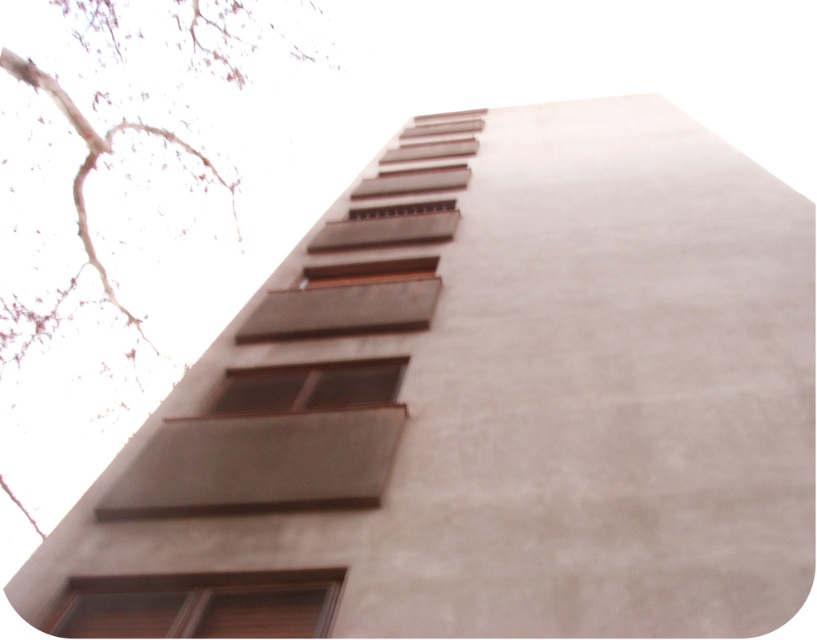
Question: Which of the following is the farthest from the observer?

Choices:
 (A) (306, 608)
 (B) (275, 388)

Answer: (B)

Question: Does brown wood tree at upper left have a smaller size compared to brown wooden window at lower left?

Choices:
 (A) no
 (B) yes

Answer: (A)

Question: Among these objects, which one is nearest to the camera?

Choices:
 (A) brown matte window at center
 (B) brown wooden window at lower left
 (C) brown wood tree at upper left

Answer: (B)

Question: Is brown wood tree at upper left positioned at the back of brown wooden window at lower left?

Choices:
 (A) no
 (B) yes

Answer: (B)

Question: Does brown wooden window at lower left have a larger size compared to brown matte window at center?

Choices:
 (A) no
 (B) yes

Answer: (A)

Question: Which is nearer to the brown wooden window at lower left?

Choices:
 (A) brown wood tree at upper left
 (B) brown matte window at center

Answer: (B)